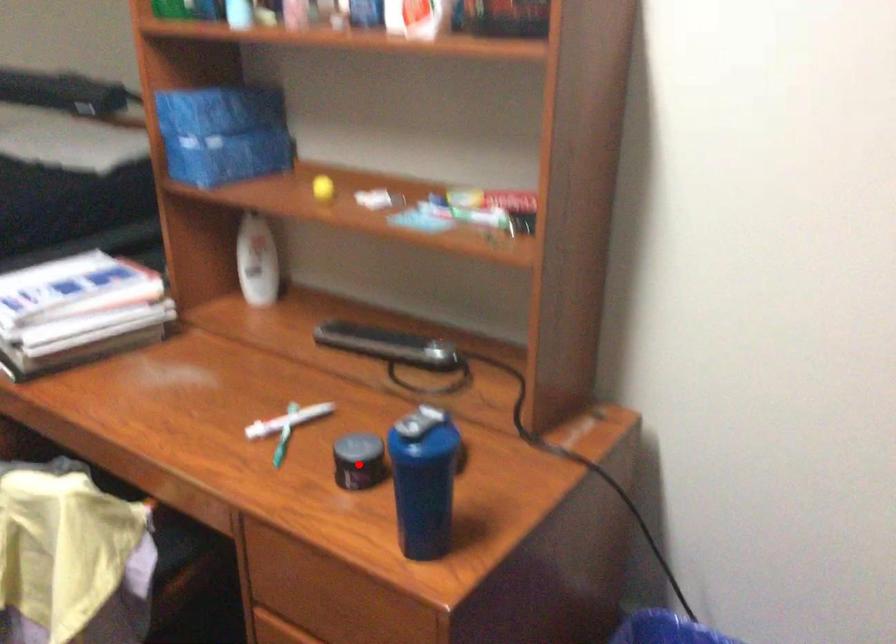
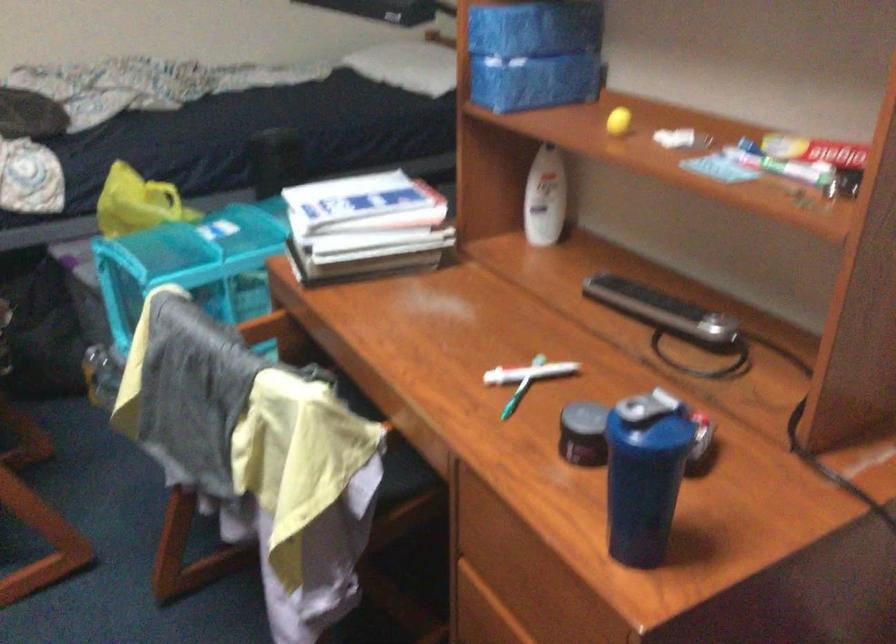
Question: I am providing you with two images of the same scene from different viewpoints. In image1, a red point is highlighted. Considering the same 3D point in image2, which of the following is correct?

Choices:
 (A) It is closer
 (B) It is farther

Answer: (A)